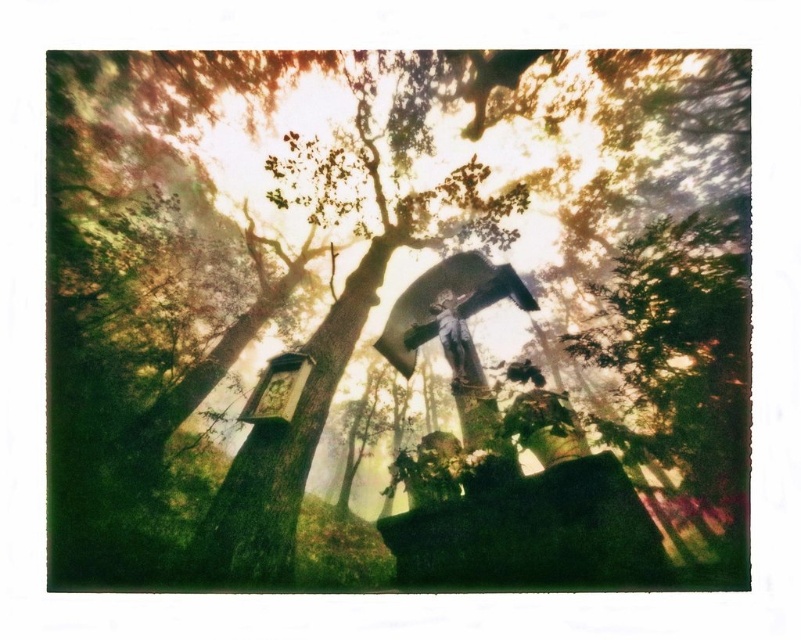
Based on the photo, you are a bird flying over the forest scene. You want to land on the tallest object between the green textured tree at center and the metallic statue at center. Which object should you choose?

The green textured tree at center is much taller than the metallic statue at center, so you should choose the green textured tree at center to land on.

You are standing in the mystical forest scene and want to move from the statue of Jesus Christ on the cross to the edge of the forest. You notice two points marked in the image. Which point, point [341,81] or point [449,321], is closer to you as you stand at the statue?

Point [341,81] is closer to you than point [449,321] because it is further to the viewer, meaning it is physically nearer in the scene.